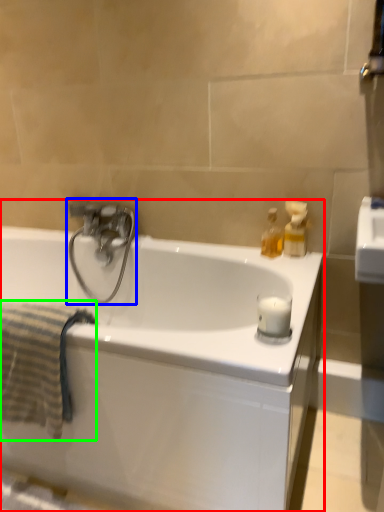
Question: Considering the real-world distances, which object is closest to bathtub (highlighted by a red box)? tap (highlighted by a blue box) or bath towel (highlighted by a green box).

Choices:
 (A) tap
 (B) bath towel

Answer: (B)